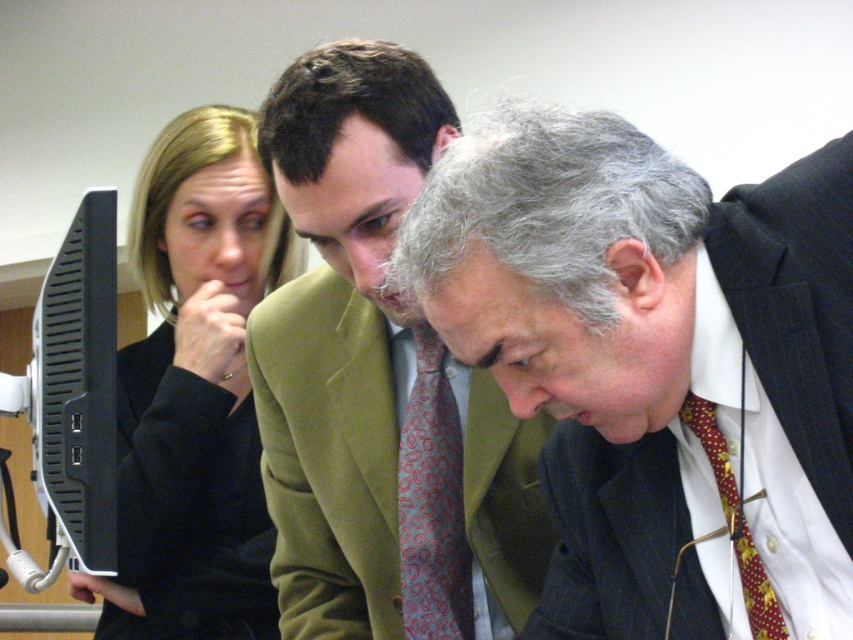
Who is shorter, dark blue pinstripe suit at lower right or black wool business suit at left?

With less height is dark blue pinstripe suit at lower right.

Image resolution: width=853 pixels, height=640 pixels. What do you see at coordinates (798, 307) in the screenshot?
I see `dark blue pinstripe suit at lower right` at bounding box center [798, 307].

Locate an element on the screen. dark blue pinstripe suit at lower right is located at coordinates (798, 307).

Does black fabric at left have a greater width compared to black plastic monitor at left?

Yes.

From the picture: Is black fabric at left thinner than black plastic monitor at left?

In fact, black fabric at left might be wider than black plastic monitor at left.

Identify the location of black fabric at left. The image size is (853, 640). (195, 390).

At what (x,y) coordinates should I click in order to perform the action: click on black wool business suit at left. Please return your answer as a coordinate pair (x, y). The image size is (853, 640). Looking at the image, I should click on (187, 504).

Which is below, black wool business suit at left or black plastic monitor at left?

black wool business suit at left

I want to click on black wool business suit at left, so click(x=187, y=504).